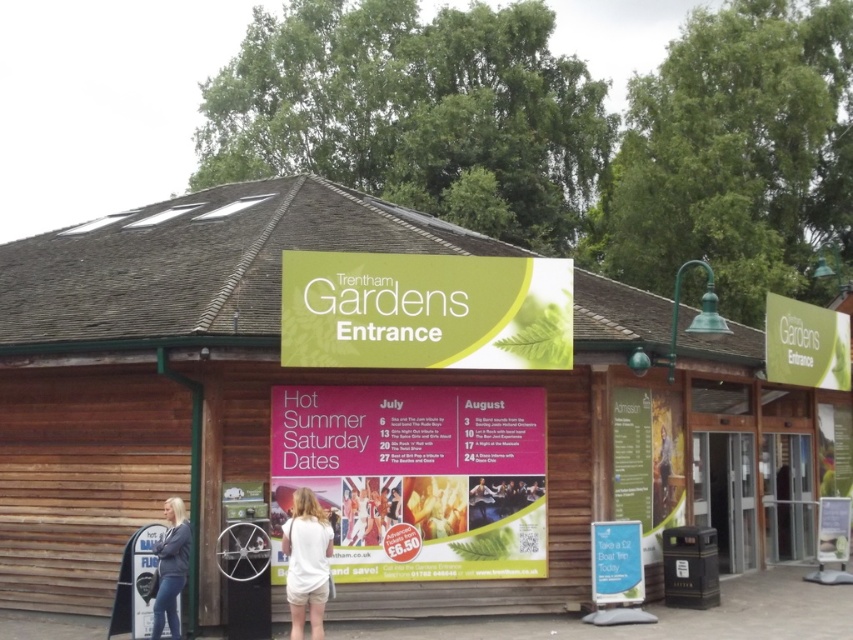
Question: Which is farther from the green matte sign at upper right?

Choices:
 (A) green matte sign at center
 (B) blonde hair at entrance
 (C) pink paper poster at center

Answer: (B)

Question: Considering the relative positions of green matte sign at upper right and blonde hair at entrance in the image provided, where is green matte sign at upper right located with respect to blonde hair at entrance?

Choices:
 (A) above
 (B) below

Answer: (A)

Question: Considering the relative positions of green matte sign at center and green matte sign at upper right in the image provided, where is green matte sign at center located with respect to green matte sign at upper right?

Choices:
 (A) left
 (B) right

Answer: (A)

Question: Which of the following is the closest to the observer?

Choices:
 (A) wooden sign at center
 (B) white cotton shirt at center

Answer: (B)

Question: Does wooden sign at center have a larger size compared to pink paper poster at center?

Choices:
 (A) yes
 (B) no

Answer: (A)

Question: Which point is closer to the camera?

Choices:
 (A) blonde hair at entrance
 (B) pink paper poster at center
 (C) green matte sign at upper right

Answer: (A)